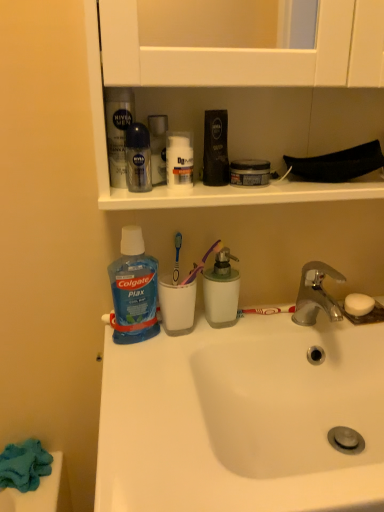
The height and width of the screenshot is (512, 384). I want to click on vacant area that is in front of translucent plastic mouthwash at center, the 2th mouthwash in the right-to-left sequence, so click(x=188, y=367).